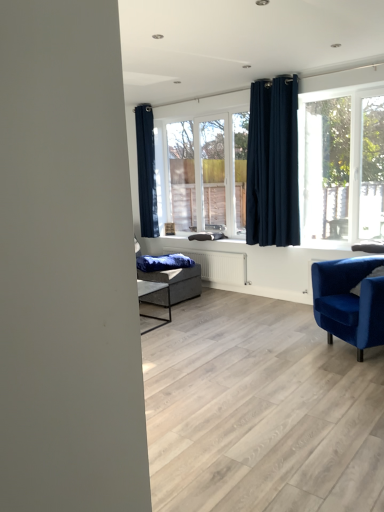
I want to click on free area below dark blue velvet curtain at upper center, marked as the 1th curtain in a front-to-back arrangement (from a real-world perspective), so click(283, 296).